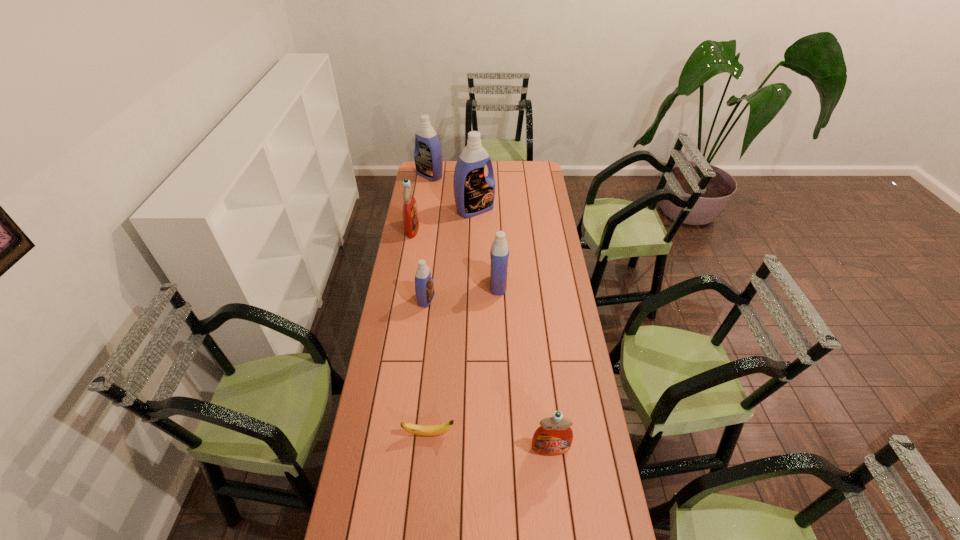
Where is `the second nearest object`? The width and height of the screenshot is (960, 540). the second nearest object is located at coordinates (425, 430).

The height and width of the screenshot is (540, 960). I want to click on banana, so click(x=425, y=430).

In order to click on vacant region located on the right of the tallest detergent in this screenshot , I will do `click(537, 210)`.

Locate an element on the screen. The height and width of the screenshot is (540, 960). vacant space located on the front of the farthest object is located at coordinates (423, 215).

The height and width of the screenshot is (540, 960). I want to click on vacant region located 0.230m on the front surface of the bigger red detergent, so click(464, 229).

At what (x,y) coordinates should I click in order to perform the action: click on vacant space located 0.370m on the back of the second smallest blue detergent. Please return your answer as a coordinate pair (x, y). This screenshot has width=960, height=540. Looking at the image, I should click on (496, 225).

Where is `free space located on the front of the smallest blue detergent`? This screenshot has height=540, width=960. free space located on the front of the smallest blue detergent is located at coordinates coord(423,321).

The height and width of the screenshot is (540, 960). In order to click on vacant space located 0.220m on the front surface of the smaller red detergent in this screenshot , I will do `click(561, 531)`.

Identify the location of vacant position located 0.290m at the stem of the banana. tap(540, 434).

Where is `object situated at the far edge`? The height and width of the screenshot is (540, 960). object situated at the far edge is located at coordinates (428, 158).